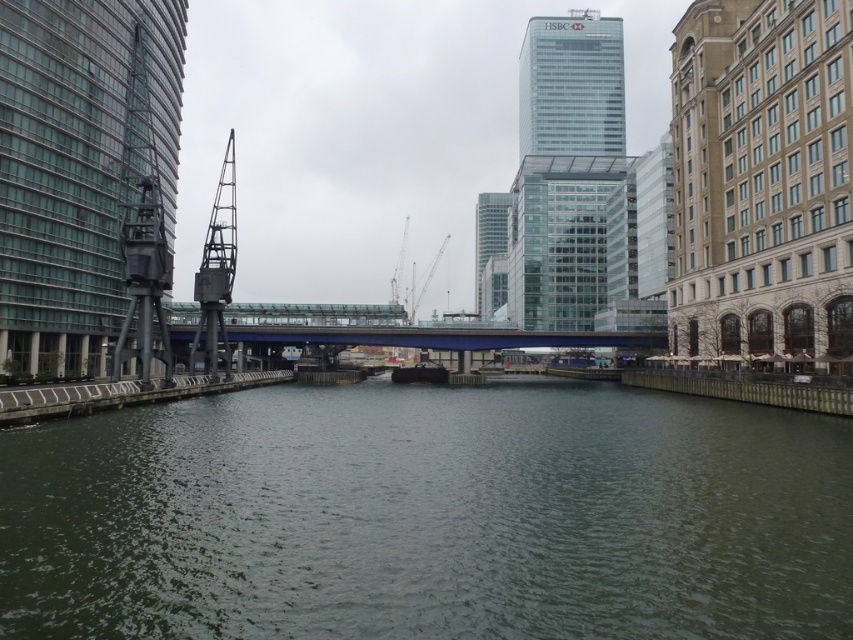
Question: Can you confirm if glassy steel tower at left is positioned to the left of glassy reflective skyscraper at center?

Choices:
 (A) yes
 (B) no

Answer: (A)

Question: Based on their relative distances, which object is farther from the blue metallic bridge at center?

Choices:
 (A) glassy steel tower at left
 (B) glassy reflective skyscraper at center

Answer: (B)

Question: Which point appears closest to the camera in this image?

Choices:
 (A) (498, 262)
 (B) (47, 362)
 (C) (577, 150)

Answer: (B)

Question: Where is transparent glass skyscraper at upper center located in relation to blue metallic bridge at center in the image?

Choices:
 (A) right
 (B) left

Answer: (A)

Question: Does green water at center appear on the left side of glassy steel tower at left?

Choices:
 (A) no
 (B) yes

Answer: (A)

Question: Among these objects, which one is farthest from the camera?

Choices:
 (A) transparent glass skyscraper at upper center
 (B) glassy steel tower at left
 (C) blue metallic bridge at center

Answer: (A)